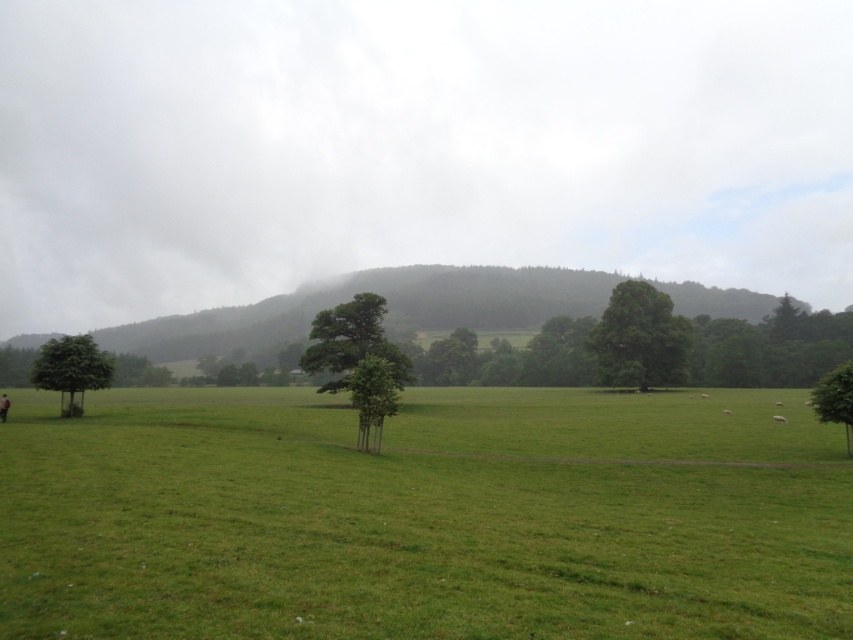
Question: Which of the following is the closest to the observer?

Choices:
 (A) (836, 380)
 (B) (39, 381)
 (C) (434, 598)
 (D) (688, 356)

Answer: (C)

Question: Which object is farther from the camera taking this photo?

Choices:
 (A) green leafy tree at right
 (B) green leafy tree at left

Answer: (B)

Question: Among these points, which one is nearest to the camera?

Choices:
 (A) (370, 330)
 (B) (825, 381)
 (C) (621, 300)

Answer: (B)

Question: Does green leafy tree at center-right appear over green leafy tree at right?

Choices:
 (A) yes
 (B) no

Answer: (A)

Question: Is green grass pasture at center positioned at the back of green leafy tree at right?

Choices:
 (A) yes
 (B) no

Answer: (B)

Question: Does green leafy tree at center-right appear on the right side of green leafy tree at right?

Choices:
 (A) no
 (B) yes

Answer: (A)